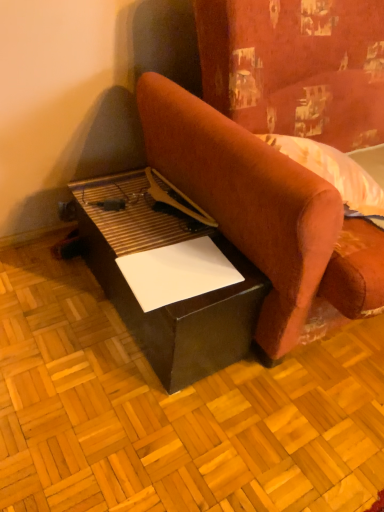
Question: From a real-world perspective, is velvet-like red couch at center positioned under white paper at lower center based on gravity?

Choices:
 (A) yes
 (B) no

Answer: (B)

Question: Is white paper at lower center located within velvet-like red couch at center?

Choices:
 (A) no
 (B) yes

Answer: (A)

Question: From a real-world perspective, does velvet-like red couch at center stand above white paper at lower center?

Choices:
 (A) yes
 (B) no

Answer: (A)

Question: Is there a large distance between velvet-like red couch at center and white paper at lower center?

Choices:
 (A) yes
 (B) no

Answer: (B)

Question: Is velvet-like red couch at center next to white paper at lower center and touching it?

Choices:
 (A) no
 (B) yes

Answer: (A)

Question: Is velvet-like red couch at center facing away from white paper at lower center?

Choices:
 (A) no
 (B) yes

Answer: (A)

Question: Is velvet-like red couch at center completely or partially inside black leather table at lower left?

Choices:
 (A) no
 (B) yes

Answer: (A)

Question: Does black leather table at lower left have a smaller size compared to velvet-like red couch at center?

Choices:
 (A) no
 (B) yes

Answer: (B)

Question: Does black leather table at lower left appear on the right side of velvet-like red couch at center?

Choices:
 (A) yes
 (B) no

Answer: (B)

Question: From the image's perspective, is black leather table at lower left on top of velvet-like red couch at center?

Choices:
 (A) yes
 (B) no

Answer: (B)

Question: Would you say black leather table at lower left is outside velvet-like red couch at center?

Choices:
 (A) no
 (B) yes

Answer: (B)

Question: Can you confirm if black leather table at lower left is wider than velvet-like red couch at center?

Choices:
 (A) yes
 (B) no

Answer: (B)

Question: Considering the relative positions of black leather table at lower left and white paper at lower center in the image provided, is black leather table at lower left to the left of white paper at lower center from the viewer's perspective?

Choices:
 (A) yes
 (B) no

Answer: (A)